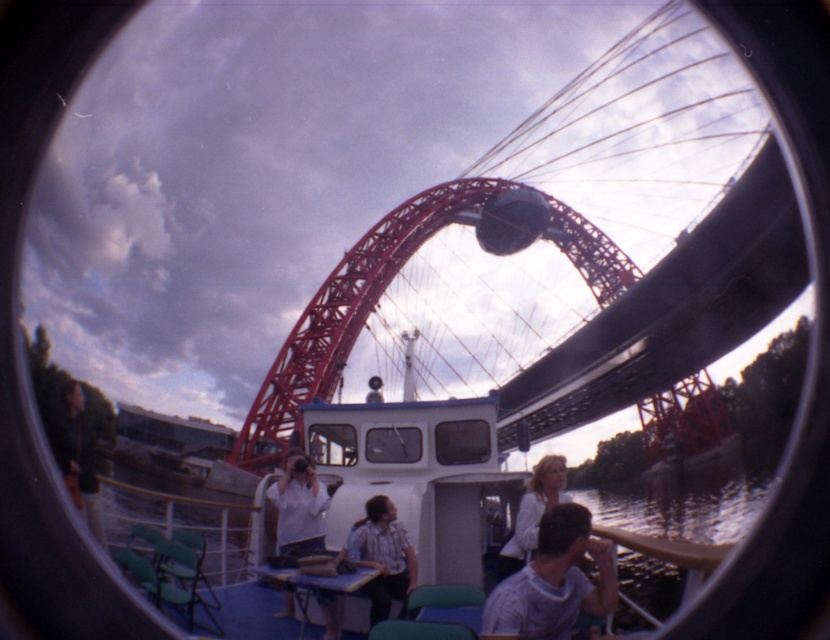
Question: Can you confirm if checkered shirt at center is positioned to the right of white matte shirt at center?

Choices:
 (A) no
 (B) yes

Answer: (B)

Question: Which point is farther to the camera?

Choices:
 (A) (492, 236)
 (B) (514, 531)
 (C) (382, 582)
 (D) (287, 486)

Answer: (A)

Question: Which point is closer to the camera?

Choices:
 (A) (564, 477)
 (B) (521, 234)
 (C) (587, 595)

Answer: (C)

Question: Which of the following is the farthest from the observer?

Choices:
 (A) (515, 193)
 (B) (533, 467)
 (C) (376, 540)

Answer: (A)

Question: Does checkered shirt at center have a lesser width compared to white shirt at center?

Choices:
 (A) yes
 (B) no

Answer: (A)

Question: Where is checkered shirt at center located in relation to black rubber lens at upper center in the image?

Choices:
 (A) left
 (B) right

Answer: (A)